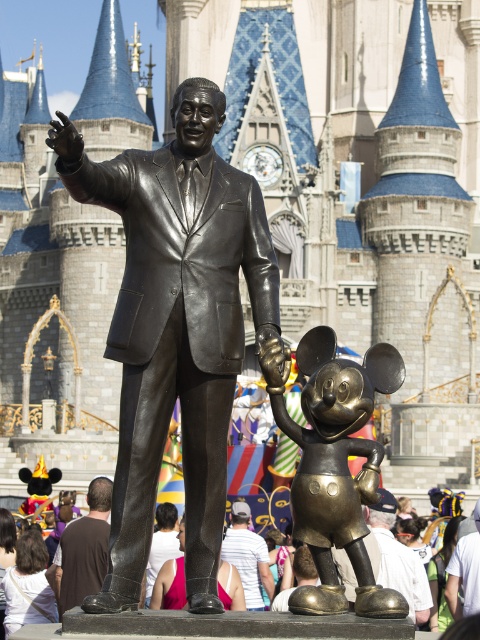
Question: Which of the following is the closest to the observer?

Choices:
 (A) (392, 362)
 (B) (248, 589)
 (C) (253, 227)
 (D) (300, 637)

Answer: (D)

Question: In this image, where is brown leather boots at lower left located relative to white cotton shirt at center?

Choices:
 (A) right
 (B) left

Answer: (B)

Question: Does white cotton shirt at lower center have a greater width compared to brown leather boots at lower left?

Choices:
 (A) yes
 (B) no

Answer: (A)

Question: Which point appears closest to the camera in this image?

Choices:
 (A) (252, 564)
 (B) (358, 529)
 (C) (148, 365)
 (D) (85, 572)

Answer: (B)

Question: Does bronze statue at center have a lesser width compared to white cotton shirt at lower center?

Choices:
 (A) yes
 (B) no

Answer: (A)

Question: Which point is closer to the camera?

Choices:
 (A) white cotton shirt at center
 (B) bronze statue at center
 (C) bronze mickey mouse statue at center

Answer: (C)